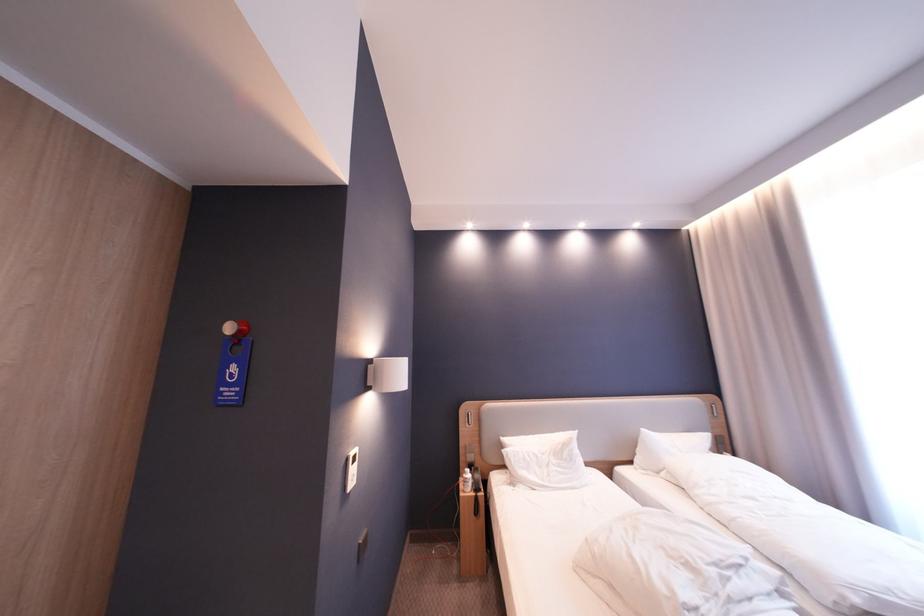
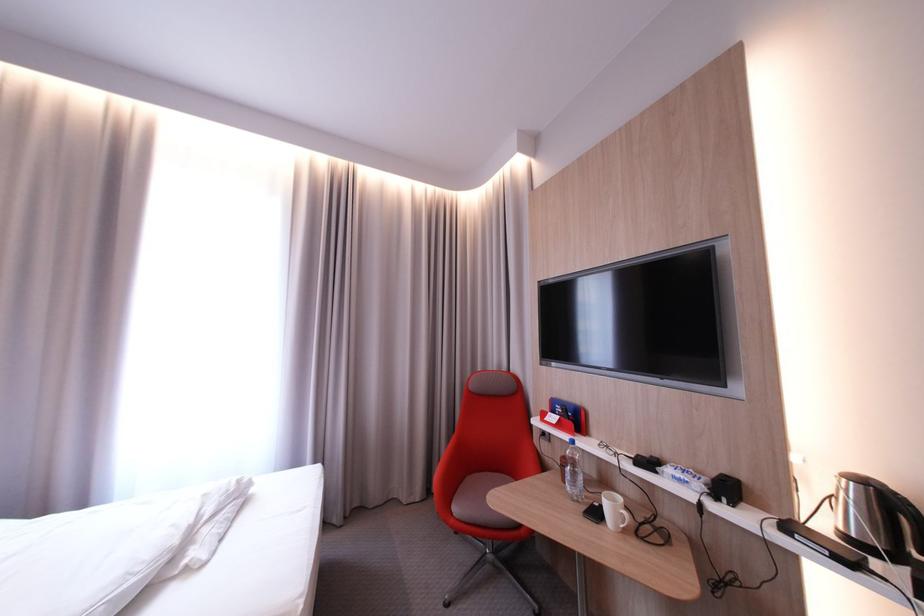
Question: The camera is either moving clockwise (left) or counter-clockwise (right) around the object. The first image is from the beginning of the video and the second image is from the end. Is the camera moving left or right when shooting the video?

Choices:
 (A) Left
 (B) Right

Answer: (A)